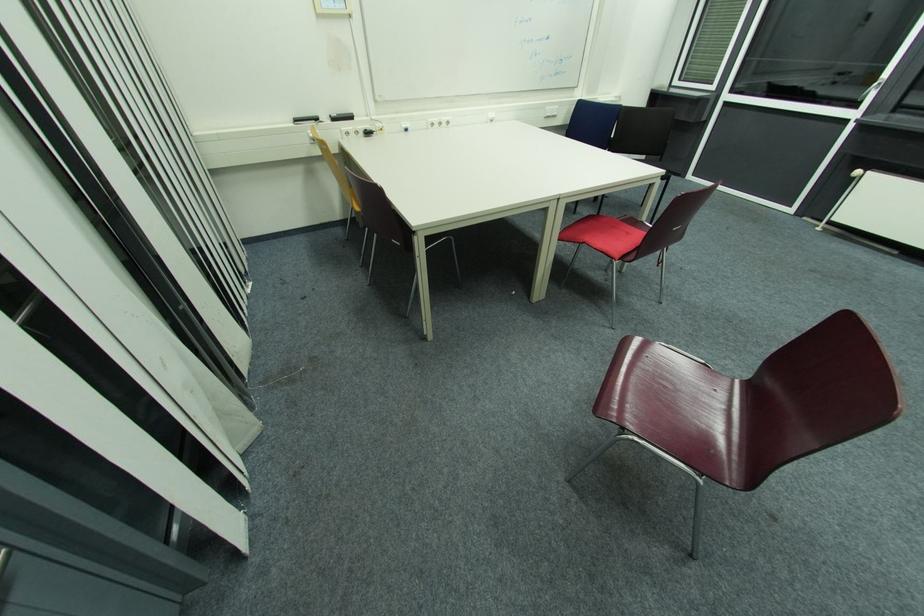
This screenshot has height=616, width=924. Identify the location of black chair sitting surface. (682, 400).